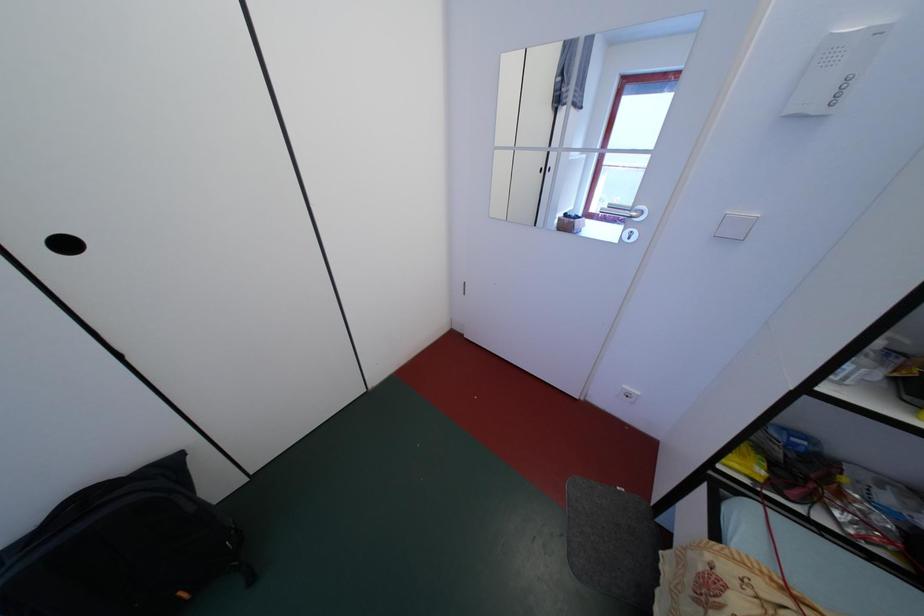
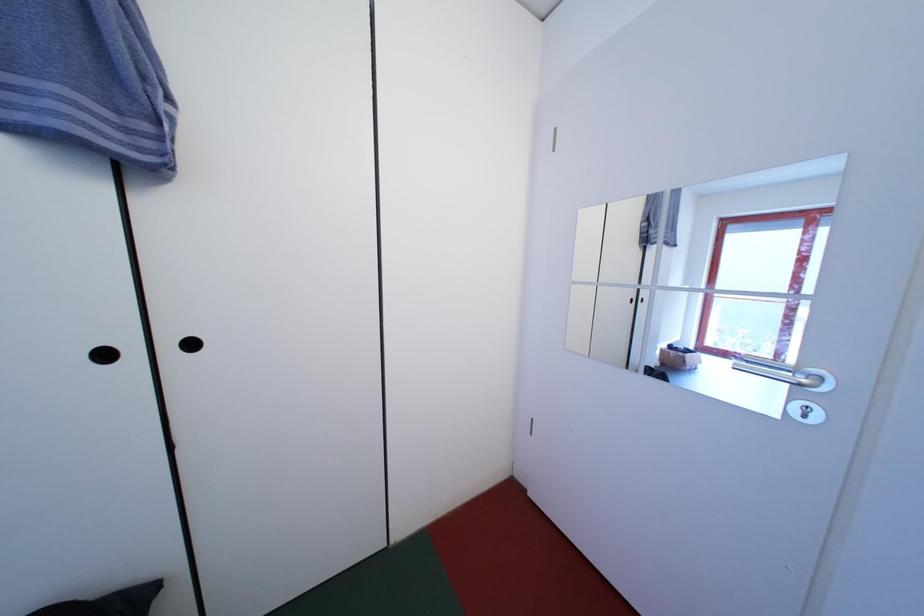
First-person continuous shooting, in which direction is the camera rotating?

The camera rotated toward left-up.